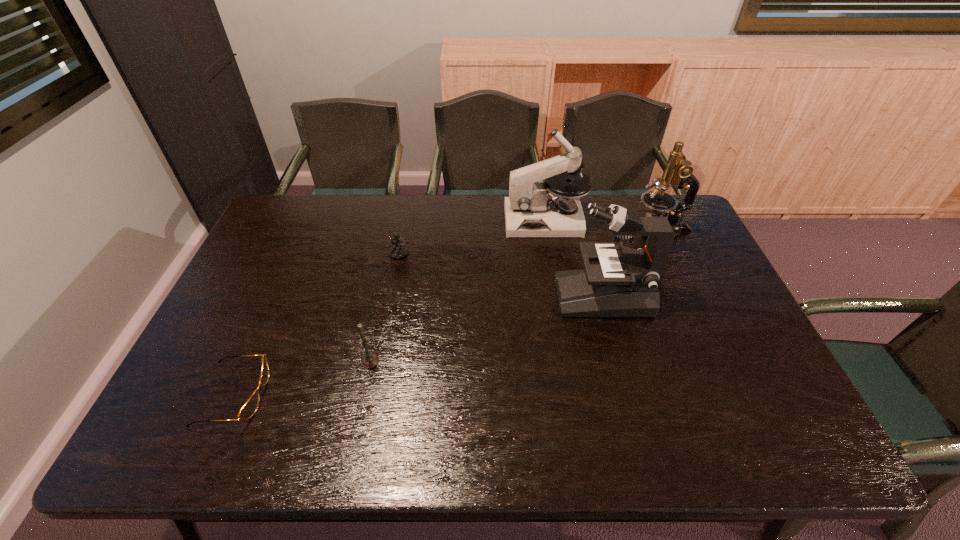
At what (x,y) coordinates should I click in order to perform the action: click on object that is at the far right corner. Please return your answer as a coordinate pair (x, y). Looking at the image, I should click on (678, 172).

I want to click on free region at the far edge of the desktop, so click(388, 226).

The image size is (960, 540). In the image, there is a desktop. What are the coordinates of `vacant space at the near edge` in the screenshot? It's located at (301, 420).

Identify the location of vacant space at the left edge. (252, 262).

In the image, there is a desktop. Identify the location of free space at the right edge. The width and height of the screenshot is (960, 540). (703, 335).

The width and height of the screenshot is (960, 540). What are the coordinates of `blank region between the leftmost object and the candle` in the screenshot? It's located at (302, 378).

Where is `vacant space that's between the fourth tallest object and the leftmost object`? Image resolution: width=960 pixels, height=540 pixels. vacant space that's between the fourth tallest object and the leftmost object is located at coordinates [302, 378].

The height and width of the screenshot is (540, 960). Identify the location of vacant area that lies between the fourth nearest object and the candle. (384, 308).

You are a GUI agent. You are given a task and a screenshot of the screen. Output one action in this format:
    pyautogui.click(x=<x>, y=<y>)
    Task: Click on the vacant region between the second shortest object and the third shortest object
    The image size is (960, 540).
    Given the screenshot: What is the action you would take?
    pyautogui.click(x=384, y=308)

Find the location of a particular element. vacant region between the leftmost object and the third nearest object is located at coordinates (419, 345).